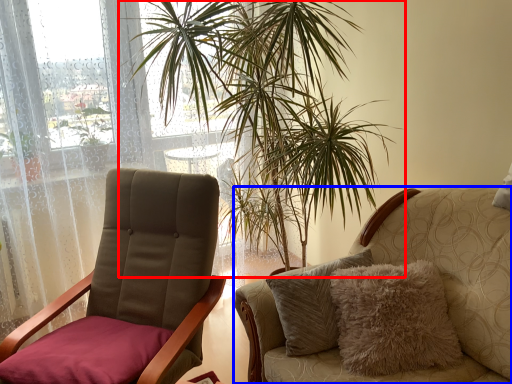
Question: Which point is closer to the camera, houseplant (highlighted by a red box) or chair (highlighted by a blue box)?

Choices:
 (A) houseplant
 (B) chair

Answer: (B)